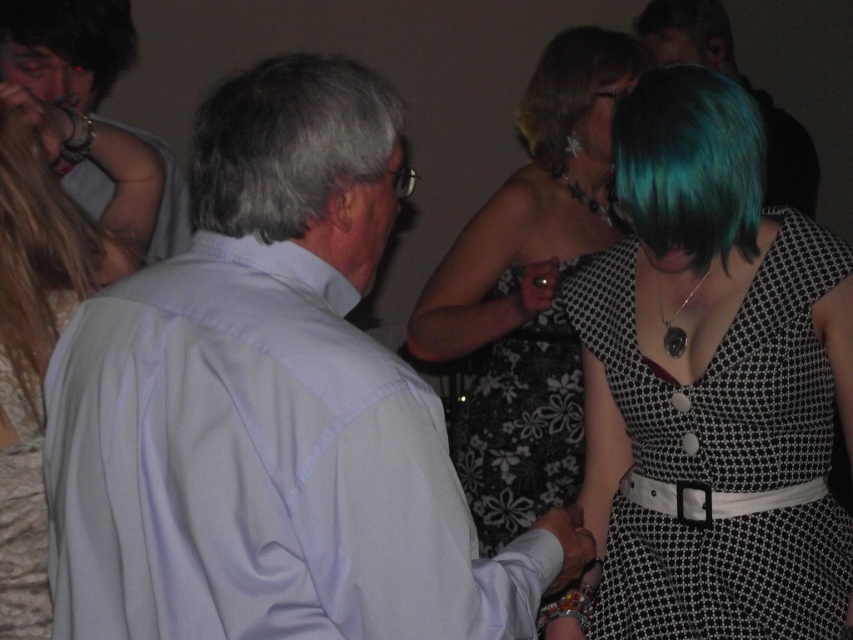
Question: Based on their relative distances, which object is nearer to the white lace dress at left?

Choices:
 (A) blonde hair at left
 (B) teal glossy hair at upper center

Answer: (A)

Question: Can you confirm if floral-patterned dress at center is bigger than teal hair at center?

Choices:
 (A) no
 (B) yes

Answer: (B)

Question: Does gray matte hair at upper center have a greater width compared to black floral dress at center?

Choices:
 (A) no
 (B) yes

Answer: (A)

Question: Which object appears closest to the camera in this image?

Choices:
 (A) teal hair at center
 (B) matte white hand at lower center

Answer: (B)

Question: Does gray matte hair at upper center appear on the right side of teal glossy hair at upper center?

Choices:
 (A) no
 (B) yes

Answer: (A)

Question: Which object is farther from the camera taking this photo?

Choices:
 (A) light blue shirt at center
 (B) teal glossy hair at upper center
 (C) matte gray shirt at upper left

Answer: (B)